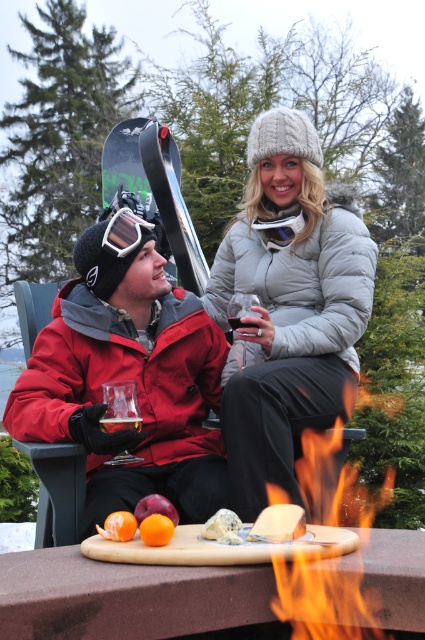
Question: Is white matte goggles at upper left behind translucent glass at lower left?

Choices:
 (A) no
 (B) yes

Answer: (B)

Question: Which point is closer to the camera taking this photo?

Choices:
 (A) (235, 520)
 (B) (181, 438)
 (C) (153, 512)

Answer: (A)

Question: From the image, what is the correct spatial relationship of matte red jacket at center in relation to red jacket at left?

Choices:
 (A) left
 (B) right

Answer: (B)

Question: Which point appears farthest from the camera in this image?

Choices:
 (A) (99, 422)
 (B) (295, 241)
 (C) (62, 292)
 (D) (238, 524)

Answer: (B)

Question: Which point is farther to the camera?

Choices:
 (A) (286, 384)
 (B) (368, 305)
 (C) (387, 545)

Answer: (B)

Question: Observing the image, what is the correct spatial positioning of matte red jacket at center in reference to blue crumbly cheese at center?

Choices:
 (A) right
 (B) left

Answer: (B)